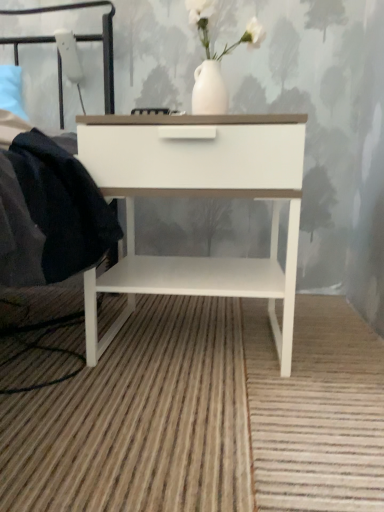
Where is `vacant location below white glossy nightstand at center (from a real-world perspective)`? This screenshot has width=384, height=512. vacant location below white glossy nightstand at center (from a real-world perspective) is located at coordinates (191, 338).